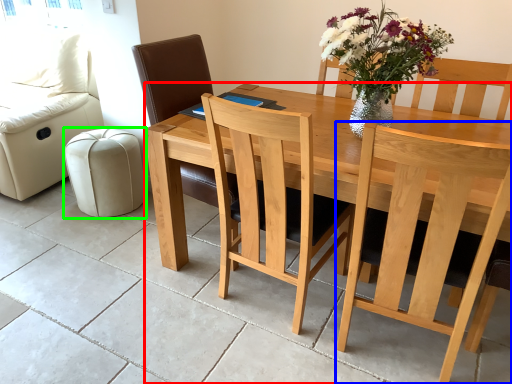
Question: Which object is positioned closest to table (highlighted by a red box)? Select from chair (highlighted by a blue box) and stool (highlighted by a green box).

Choices:
 (A) chair
 (B) stool

Answer: (A)